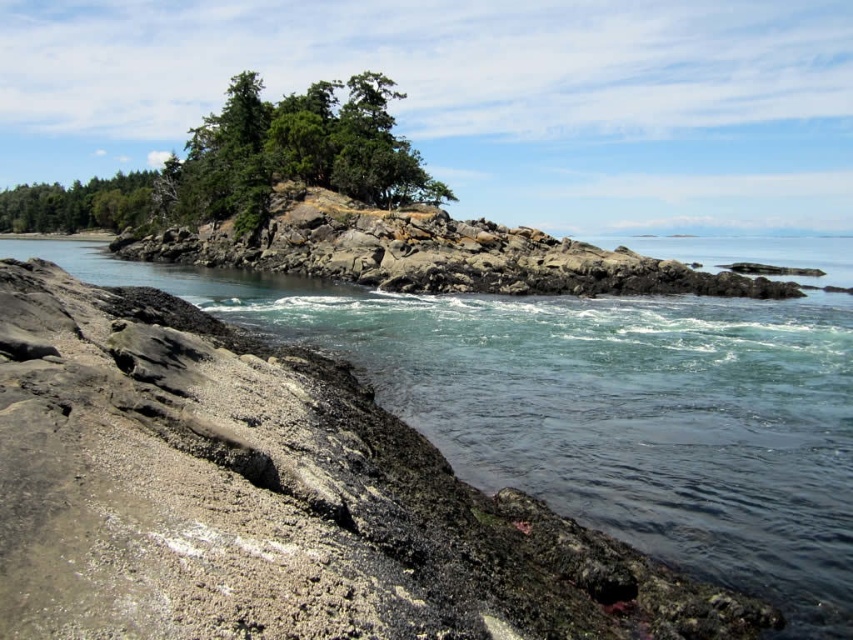
Is clear water at center below rough granite rock at center?

No.

Which is in front, point (668, 349) or point (282, 202)?

Point (668, 349)

Does point (543, 300) come in front of point (437, 236)?

That is True.

Find the location of a particular element. This screenshot has height=640, width=853. clear water at center is located at coordinates (599, 404).

Who is lower down, green textured rock at upper center or green matte tree at upper left?

green textured rock at upper center is below.

Which of these two, green textured rock at upper center or green matte tree at upper left, stands taller?

green matte tree at upper left

The height and width of the screenshot is (640, 853). Find the location of `green textured rock at upper center`. green textured rock at upper center is located at coordinates (294, 150).

Identify the location of green textured rock at upper center. (294, 150).

Between rough granite rock at center and green textured rock at upper center, which one appears on the left side from the viewer's perspective?

green textured rock at upper center is more to the left.

Does rough granite rock at center have a greater width compared to green textured rock at upper center?

Yes.

I want to click on rough granite rock at center, so click(x=427, y=252).

Where is `rough granite rock at center`? rough granite rock at center is located at coordinates (427, 252).